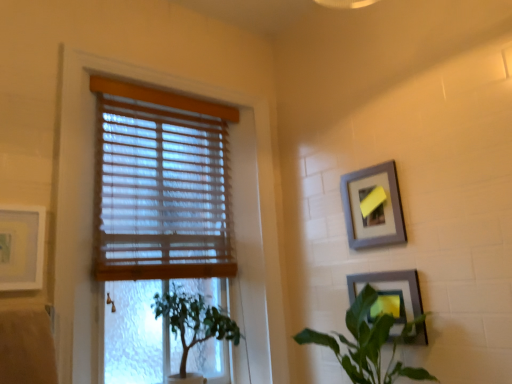
What is the approximate width of gray matte picture frame at upper right, the second picture frame when ordered from left to right?

gray matte picture frame at upper right, the second picture frame when ordered from left to right, is 1.58 inches wide.

Describe the element at coordinates (392, 293) in the screenshot. The image size is (512, 384). I see `matte gray picture frame at lower right, which is the first picture frame from right to left` at that location.

This screenshot has width=512, height=384. What do you see at coordinates (193, 325) in the screenshot?
I see `green leafy plant at lower left, which ranks as the 2th houseplant in right-to-left order` at bounding box center [193, 325].

Measure the distance between point (261, 300) and camera.

Point (261, 300) is 6.38 feet from camera.

What are the coordinates of `green leafy plant at lower right, which is the 1th houseplant from right to left` in the screenshot? It's located at (368, 343).

Identify the location of matte white picture frame at left, the 1th picture frame in the left-to-right sequence. The image size is (512, 384). (21, 247).

The image size is (512, 384). What do you see at coordinates (21, 247) in the screenshot?
I see `matte white picture frame at left, placed as the 3th picture frame when sorted from right to left` at bounding box center [21, 247].

You are a GUI agent. You are given a task and a screenshot of the screen. Output one action in this format:
    pyautogui.click(x=<x>, y=<y>)
    Task: Click on the gray matte picture frame at upper right, the second picture frame positioned from the right
    The image size is (512, 384).
    Given the screenshot: What is the action you would take?
    pyautogui.click(x=373, y=207)

What's the angular difference between matte gray picture frame at lower right, the 3th picture frame when ordered from left to right, and green leafy plant at lower right, which is the 1th houseplant from right to left,'s facing directions?

The angular difference between matte gray picture frame at lower right, the 3th picture frame when ordered from left to right, and green leafy plant at lower right, which is the 1th houseplant from right to left, is 0.337 degrees.

Consider the image. Is matte gray picture frame at lower right, which is the first picture frame from right to left, positioned with its back to green leafy plant at lower right, positioned as the 2th houseplant in left-to-right order?

That's right, matte gray picture frame at lower right, which is the first picture frame from right to left, is facing away from green leafy plant at lower right, positioned as the 2th houseplant in left-to-right order.

Image resolution: width=512 pixels, height=384 pixels. In order to click on picture frame that is the 2nd one when counting rightward from the green leafy plant at lower right, positioned as the 2th houseplant in left-to-right order in this screenshot , I will do `click(392, 293)`.

Based on the photo, considering the sizes of matte white picture frame at left, the 1th picture frame in the left-to-right sequence, and wooden blinds at upper left in the image, is matte white picture frame at left, the 1th picture frame in the left-to-right sequence, taller or shorter than wooden blinds at upper left?

Considering their sizes, matte white picture frame at left, the 1th picture frame in the left-to-right sequence, has less height than wooden blinds at upper left.

Is matte white picture frame at left, the 1th picture frame in the left-to-right sequence, aimed at wooden blinds at upper left?

No, matte white picture frame at left, the 1th picture frame in the left-to-right sequence, is not turned towards wooden blinds at upper left.

Can you confirm if matte white picture frame at left, the 1th picture frame in the left-to-right sequence, is positioned to the right of wooden blinds at upper left?

Incorrect, matte white picture frame at left, the 1th picture frame in the left-to-right sequence, is not on the right side of wooden blinds at upper left.

Based on their sizes in the image, would you say matte white picture frame at left, the 1th picture frame in the left-to-right sequence, is bigger or smaller than wooden blinds at upper left?

Considering their sizes, matte white picture frame at left, the 1th picture frame in the left-to-right sequence, takes up less space than wooden blinds at upper left.

Does matte gray picture frame at lower right, which is the first picture frame from right to left, have a smaller size compared to gray matte picture frame at upper right, the second picture frame when ordered from left to right?

Correct, matte gray picture frame at lower right, which is the first picture frame from right to left, occupies less space than gray matte picture frame at upper right, the second picture frame when ordered from left to right.

Consider the image. Would you say matte gray picture frame at lower right, which is the first picture frame from right to left, is inside or outside gray matte picture frame at upper right, the second picture frame positioned from the right?

matte gray picture frame at lower right, which is the first picture frame from right to left, is not enclosed by gray matte picture frame at upper right, the second picture frame positioned from the right.

Which of these two, matte gray picture frame at lower right, the 3th picture frame when ordered from left to right, or gray matte picture frame at upper right, the second picture frame when ordered from left to right, stands taller?

With more height is gray matte picture frame at upper right, the second picture frame when ordered from left to right.

Looking at this image, which is further, (396, 288) or (378, 215)?

Positioned behind is point (378, 215).

Choose the correct answer: Is gray matte picture frame at upper right, the second picture frame when ordered from left to right, inside green leafy plant at lower left, the first houseplant in the left-to-right sequence, or outside it?

gray matte picture frame at upper right, the second picture frame when ordered from left to right, is spatially situated outside green leafy plant at lower left, the first houseplant in the left-to-right sequence.

This screenshot has width=512, height=384. There is a green leafy plant at lower left, the first houseplant in the left-to-right sequence. What are the coordinates of `the 3rd picture frame above it (from a real-world perspective)` in the screenshot? It's located at (373, 207).

Is gray matte picture frame at upper right, the second picture frame when ordered from left to right, far from green leafy plant at lower left, which ranks as the 2th houseplant in right-to-left order?

No.

How distant is gray matte picture frame at upper right, the second picture frame when ordered from left to right, from green leafy plant at lower left, the first houseplant in the left-to-right sequence?

gray matte picture frame at upper right, the second picture frame when ordered from left to right, and green leafy plant at lower left, the first houseplant in the left-to-right sequence, are 28.85 inches apart.

From a real-world perspective, does matte white picture frame at left, placed as the 3th picture frame when sorted from right to left, stand above green leafy plant at lower right, positioned as the 2th houseplant in left-to-right order?

Yes, from a real-world perspective, matte white picture frame at left, placed as the 3th picture frame when sorted from right to left, is above green leafy plant at lower right, positioned as the 2th houseplant in left-to-right order.

Is point (33, 232) closer or farther from the camera than point (398, 362)?

Point (33, 232).

Is green leafy plant at lower right, positioned as the 2th houseplant in left-to-right order, located within matte white picture frame at left, placed as the 3th picture frame when sorted from right to left?

No, green leafy plant at lower right, positioned as the 2th houseplant in left-to-right order, is not inside matte white picture frame at left, placed as the 3th picture frame when sorted from right to left.

Can you confirm if matte white picture frame at left, placed as the 3th picture frame when sorted from right to left, is positioned to the right of green leafy plant at lower right, positioned as the 2th houseplant in left-to-right order?

Incorrect, matte white picture frame at left, placed as the 3th picture frame when sorted from right to left, is not on the right side of green leafy plant at lower right, positioned as the 2th houseplant in left-to-right order.

Relative to green leafy plant at lower left, which ranks as the 2th houseplant in right-to-left order, is wooden blinds at left in front or behind?

Visually, wooden blinds at left is located in front of green leafy plant at lower left, which ranks as the 2th houseplant in right-to-left order.

Which of these two, wooden blinds at left or green leafy plant at lower left, which ranks as the 2th houseplant in right-to-left order, stands shorter?

Standing shorter between the two is green leafy plant at lower left, which ranks as the 2th houseplant in right-to-left order.

Does wooden blinds at left turn towards green leafy plant at lower left, which ranks as the 2th houseplant in right-to-left order?

Yes.

Can green leafy plant at lower left, the first houseplant in the left-to-right sequence, be found inside wooden blinds at left?

Yes.

How many degrees apart are the facing directions of wooden blinds at left and green leafy plant at lower right, which is the 1th houseplant from right to left?

88.7 degrees separate the facing orientations of wooden blinds at left and green leafy plant at lower right, which is the 1th houseplant from right to left.

Does wooden blinds at left come behind green leafy plant at lower right, positioned as the 2th houseplant in left-to-right order?

That is True.

Does point (74, 250) come in front of point (327, 334)?

Yes, it is.

Between wooden blinds at left and green leafy plant at lower right, positioned as the 2th houseplant in left-to-right order, which one has larger size?

wooden blinds at left.

From the image's perspective, which houseplant is the 1st one below the matte gray picture frame at lower right, the 3th picture frame when ordered from left to right? Please provide its 2D coordinates.

[(368, 343)]

Identify the location of picture frame that is the 2nd one when counting forward from the wooden blinds at upper left. coord(21,247).

From the image, which object appears to be nearer to green leafy plant at lower right, which is the 1th houseplant from right to left, gray matte picture frame at upper right, the second picture frame when ordered from left to right, or wooden blinds at left?

gray matte picture frame at upper right, the second picture frame when ordered from left to right, is positioned closer to the anchor green leafy plant at lower right, which is the 1th houseplant from right to left.

When comparing their distances from matte white picture frame at left, the 1th picture frame in the left-to-right sequence, does gray matte picture frame at upper right, the second picture frame when ordered from left to right, or matte gray picture frame at lower right, the 3th picture frame when ordered from left to right, seem closer?

gray matte picture frame at upper right, the second picture frame when ordered from left to right.

Estimate the real-world distances between objects in this image. Which object is closer to matte gray picture frame at lower right, which is the first picture frame from right to left, wooden blinds at upper left or wooden blinds at left?

wooden blinds at left is positioned closer to the anchor matte gray picture frame at lower right, which is the first picture frame from right to left.

Estimate the real-world distances between objects in this image. Which object is closer to matte white picture frame at left, placed as the 3th picture frame when sorted from right to left, green leafy plant at lower right, which is the 1th houseplant from right to left, or wooden blinds at upper left?

wooden blinds at upper left lies closer to matte white picture frame at left, placed as the 3th picture frame when sorted from right to left, than the other object.

Based on their spatial positions, is green leafy plant at lower left, the first houseplant in the left-to-right sequence, or gray matte picture frame at upper right, the second picture frame when ordered from left to right, further from matte gray picture frame at lower right, the 3th picture frame when ordered from left to right?

green leafy plant at lower left, the first houseplant in the left-to-right sequence, is positioned further to the anchor matte gray picture frame at lower right, the 3th picture frame when ordered from left to right.

Which object lies nearer to the anchor point green leafy plant at lower left, which ranks as the 2th houseplant in right-to-left order, green leafy plant at lower right, positioned as the 2th houseplant in left-to-right order, or wooden blinds at left?

Based on the image, wooden blinds at left appears to be nearer to green leafy plant at lower left, which ranks as the 2th houseplant in right-to-left order.

Which object lies further to the anchor point green leafy plant at lower left, which ranks as the 2th houseplant in right-to-left order, green leafy plant at lower right, positioned as the 2th houseplant in left-to-right order, or gray matte picture frame at upper right, the second picture frame positioned from the right?

gray matte picture frame at upper right, the second picture frame positioned from the right, is further to green leafy plant at lower left, which ranks as the 2th houseplant in right-to-left order.

Looking at the image, which one is located closer to matte white picture frame at left, the 1th picture frame in the left-to-right sequence, green leafy plant at lower left, the first houseplant in the left-to-right sequence, or green leafy plant at lower right, positioned as the 2th houseplant in left-to-right order?

Based on the image, green leafy plant at lower left, the first houseplant in the left-to-right sequence, appears to be nearer to matte white picture frame at left, the 1th picture frame in the left-to-right sequence.

This screenshot has width=512, height=384. In order to click on houseplant between wooden blinds at left and green leafy plant at lower right, positioned as the 2th houseplant in left-to-right order, in the horizontal direction in this screenshot , I will do `click(193, 325)`.

I want to click on picture frame between matte white picture frame at left, the 1th picture frame in the left-to-right sequence, and matte gray picture frame at lower right, which is the first picture frame from right to left, in the horizontal direction, so click(373, 207).

I want to click on window frame situated between matte white picture frame at left, placed as the 3th picture frame when sorted from right to left, and wooden blinds at upper left from left to right, so click(x=233, y=211).

Where is `window frame between matte white picture frame at left, the 1th picture frame in the left-to-right sequence, and green leafy plant at lower left, which ranks as the 2th houseplant in right-to-left order, from left to right`? Image resolution: width=512 pixels, height=384 pixels. window frame between matte white picture frame at left, the 1th picture frame in the left-to-right sequence, and green leafy plant at lower left, which ranks as the 2th houseplant in right-to-left order, from left to right is located at coordinates (233, 211).